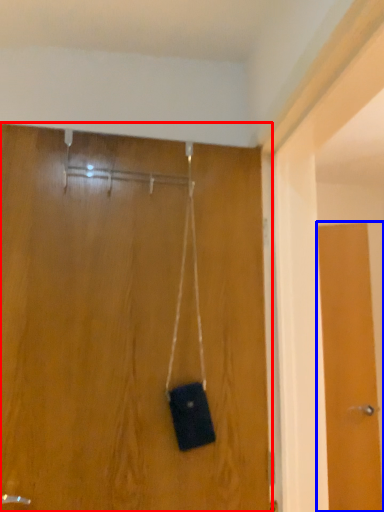
Question: Which point is closer to the camera, door (highlighted by a red box) or door (highlighted by a blue box)?

Choices:
 (A) door
 (B) door

Answer: (A)